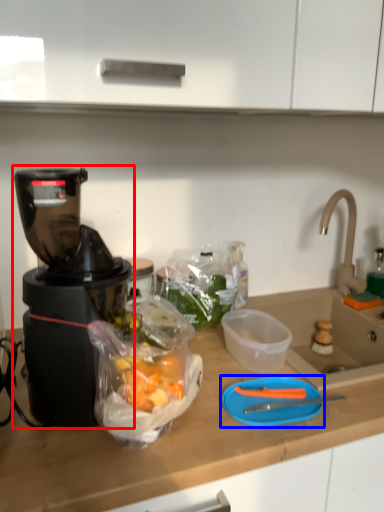
Question: Which point is closer to the camera, blender (highlighted by a red box) or cutting board (highlighted by a blue box)?

Choices:
 (A) blender
 (B) cutting board

Answer: (A)